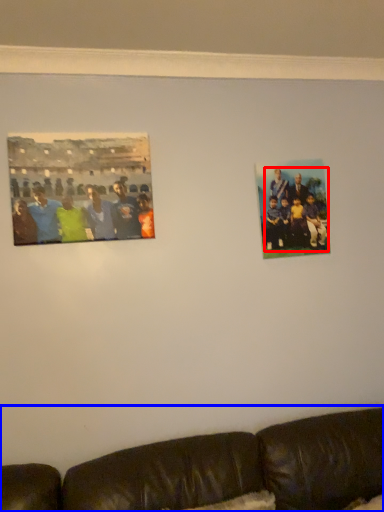
Question: Which object appears closest to the camera in this image, person (highlighted by a red box) or studio couch (highlighted by a blue box)?

Choices:
 (A) person
 (B) studio couch

Answer: (B)